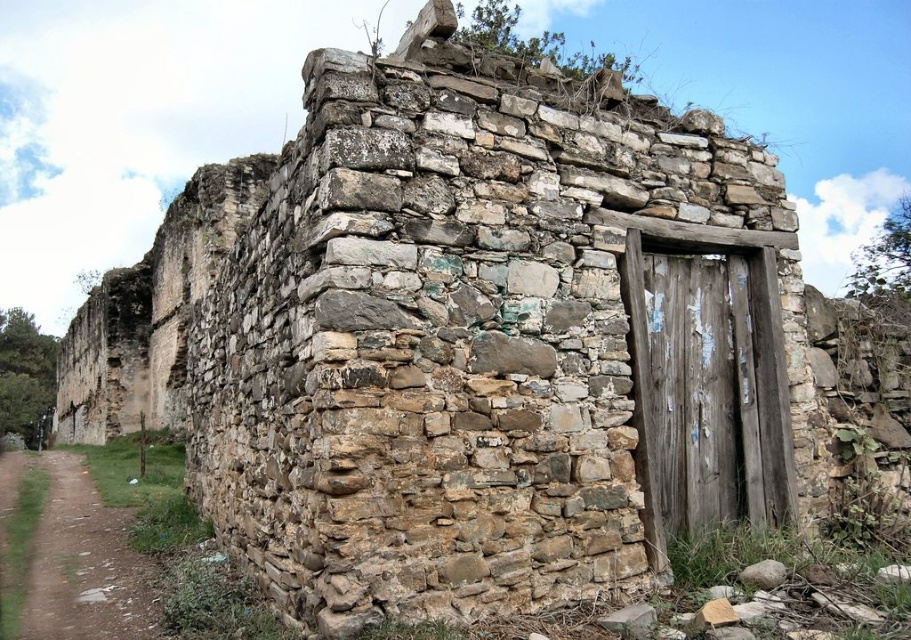
Question: Observing the image, what is the correct spatial positioning of weathered wood door at right in reference to dirt/gravel path at lower left?

Choices:
 (A) left
 (B) right

Answer: (B)

Question: Is weathered wood door at right above dirt/gravel path at lower left?

Choices:
 (A) yes
 (B) no

Answer: (A)

Question: Which of the following is the closest to the observer?

Choices:
 (A) weathered wood door at right
 (B) dirt/gravel path at lower left

Answer: (B)

Question: Observing the image, what is the correct spatial positioning of weathered wood door at right in reference to dirt/gravel path at lower left?

Choices:
 (A) right
 (B) left

Answer: (A)

Question: Which point is farther from the camera taking this photo?

Choices:
 (A) pyautogui.click(x=749, y=490)
 (B) pyautogui.click(x=84, y=496)

Answer: (B)